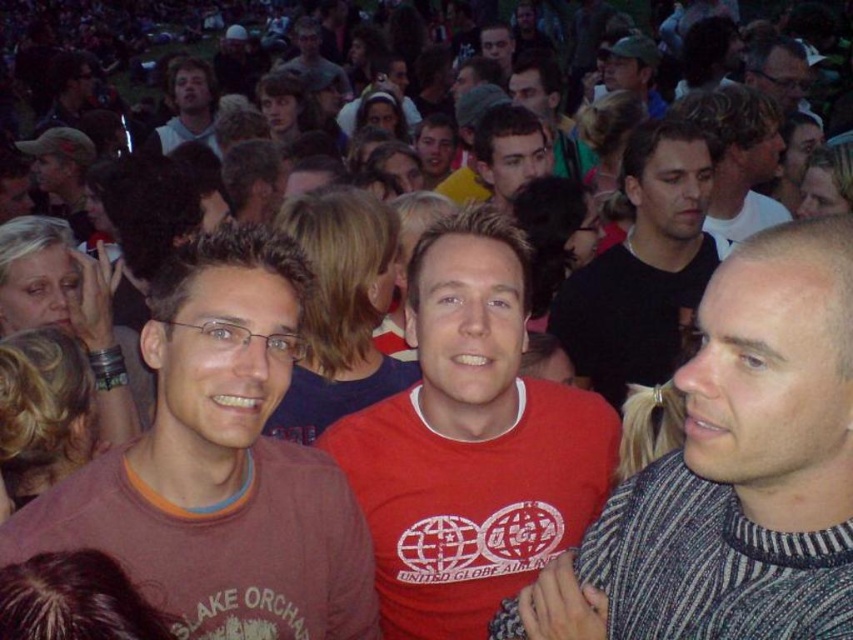
Looking at this image, you are at a concert and need to find your friend who is wearing a black matte shirt. You see two people in black matte shirts in the crowd. One is the black matte shirt at center and the other is the matte black shirt at upper right. Which one is closer to your left side?

The black matte shirt at center is to the left of matte black shirt at upper right, so the black matte shirt at center is closer to your left side.